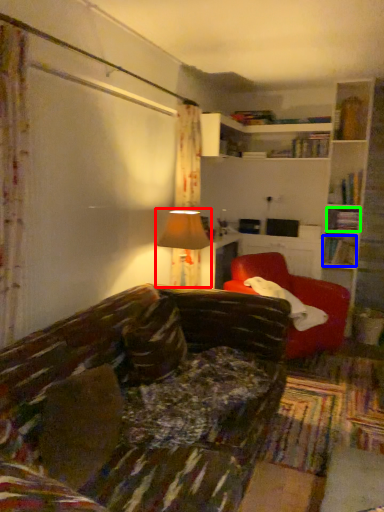
Question: Which is farther away from table lamp (highlighted by a red box)? book (highlighted by a blue box) or book (highlighted by a green box)?

Choices:
 (A) book
 (B) book

Answer: (B)